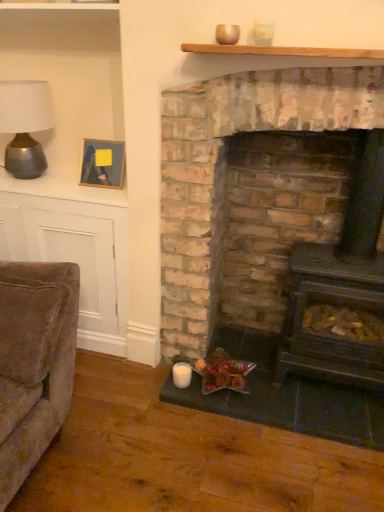
Question: From a real-world perspective, is matte silver table lamp at left above or below brick fireplace at center?

Choices:
 (A) below
 (B) above

Answer: (B)

Question: Is matte silver table lamp at left bigger or smaller than brick fireplace at center?

Choices:
 (A) small
 (B) big

Answer: (A)

Question: Estimate the real-world distances between objects in this image. Which object is farther from the brick fireplace at center?

Choices:
 (A) matte silver table lamp at left
 (B) dark gray cast iron wood burning stove at center
 (C) wooden picture frame at upper left
 (D) wooden mantle at upper center
 (E) shiny brown nuts at lower center

Answer: (A)

Question: Considering the real-world distances, which object is closest to the dark gray cast iron wood burning stove at center?

Choices:
 (A) brick fireplace at center
 (B) shiny brown nuts at lower center
 (C) matte silver table lamp at left
 (D) wooden mantle at upper center
 (E) wooden picture frame at upper left

Answer: (A)